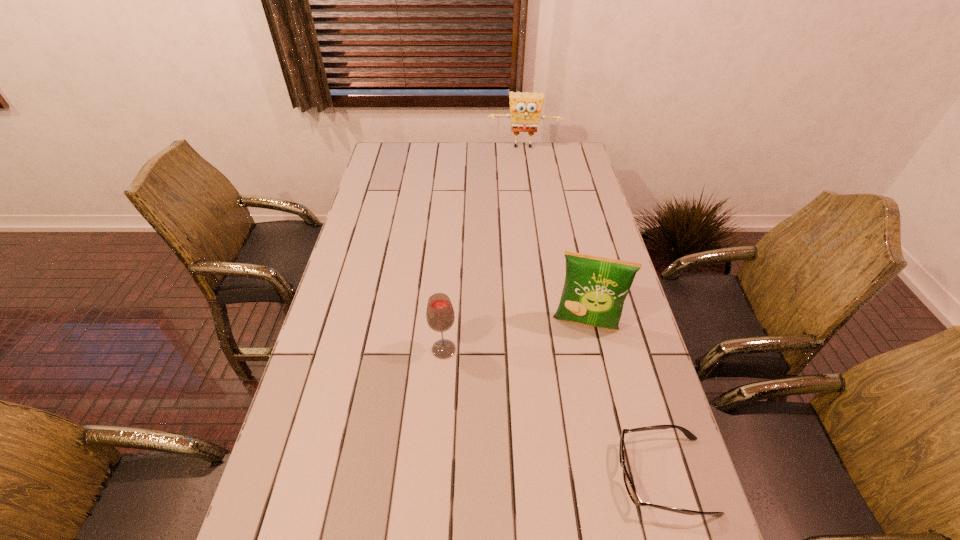
Locate an element on the screen. crisp (potato chip) that is at the right edge is located at coordinates (595, 288).

Locate an element on the screen. object present at the far right corner is located at coordinates (525, 108).

Find the location of a particular element. The width and height of the screenshot is (960, 540). object present at the near right corner is located at coordinates pos(632,493).

Where is `vacant space at the far edge of the desktop`? The image size is (960, 540). vacant space at the far edge of the desktop is located at coordinates (461, 147).

Locate an element on the screen. vacant space at the near edge of the desktop is located at coordinates (490, 498).

You are a GUI agent. You are given a task and a screenshot of the screen. Output one action in this format:
    pyautogui.click(x=<x>, y=<y>)
    Task: Click on the free space at the left edge of the desktop
    
    Given the screenshot: What is the action you would take?
    pyautogui.click(x=401, y=190)

Find the location of a particular element. free region at the right edge is located at coordinates [x=632, y=441].

This screenshot has width=960, height=540. In order to click on free space at the far right corner in this screenshot , I will do `click(581, 152)`.

Image resolution: width=960 pixels, height=540 pixels. In the image, there is a desktop. In order to click on vacant area at the near right corner in this screenshot , I will do `click(684, 522)`.

The height and width of the screenshot is (540, 960). Identify the location of free spot between the nearest object and the third farthest object. (554, 413).